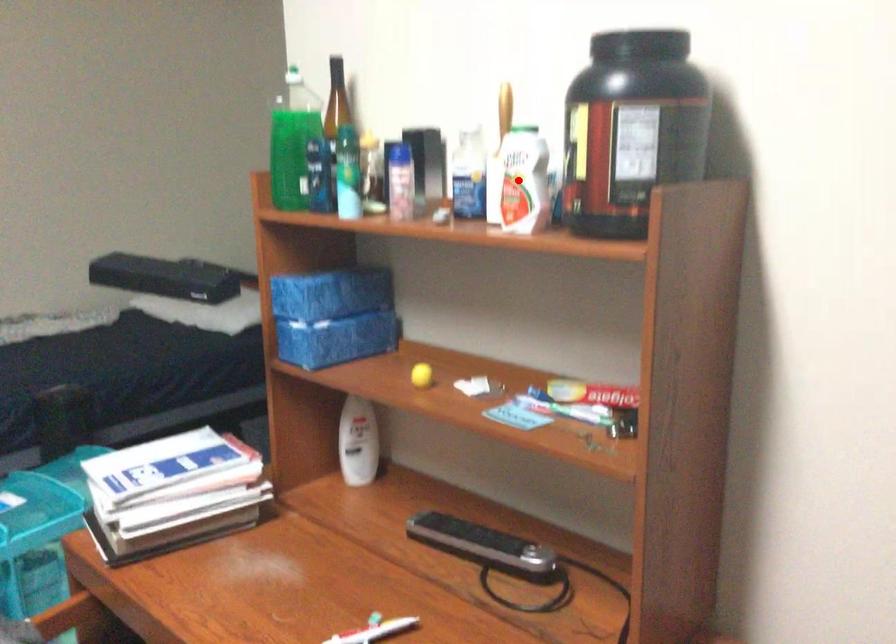
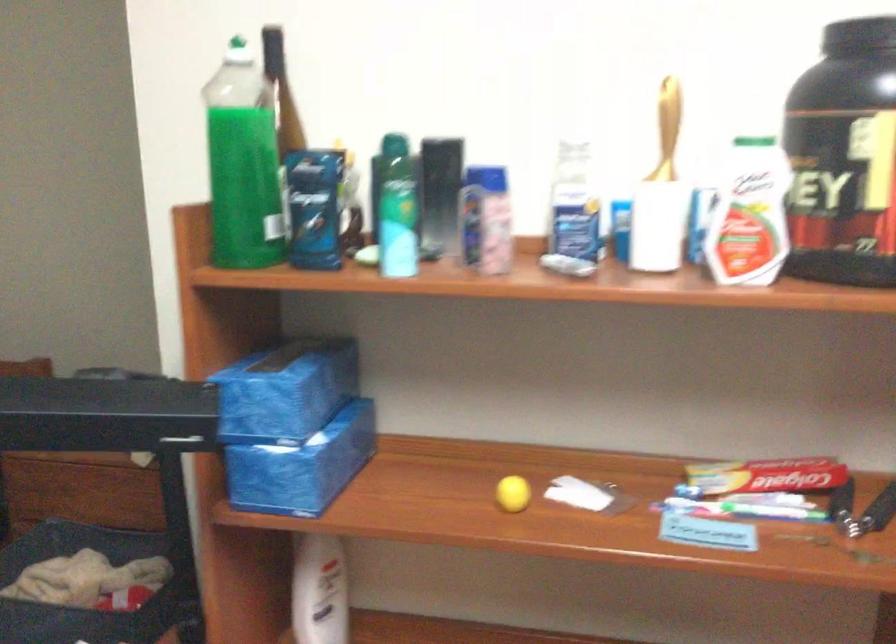
Question: A red point is marked in image1. In image2, is the corresponding 3D point closer to the camera or farther? Reply with the corresponding letter.

Choices:
 (A) The corresponding 3D point is closer.
 (B) The corresponding 3D point is farther.

Answer: (A)